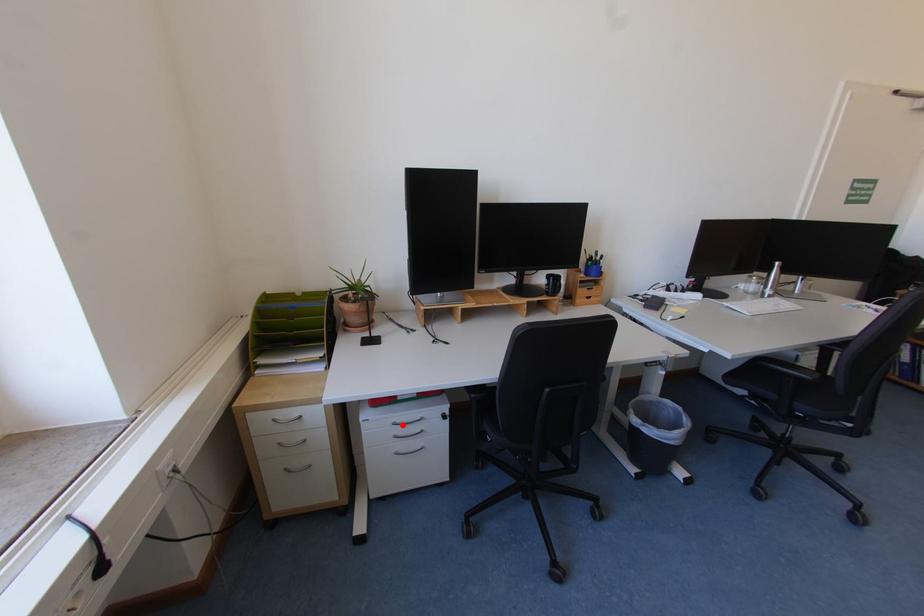
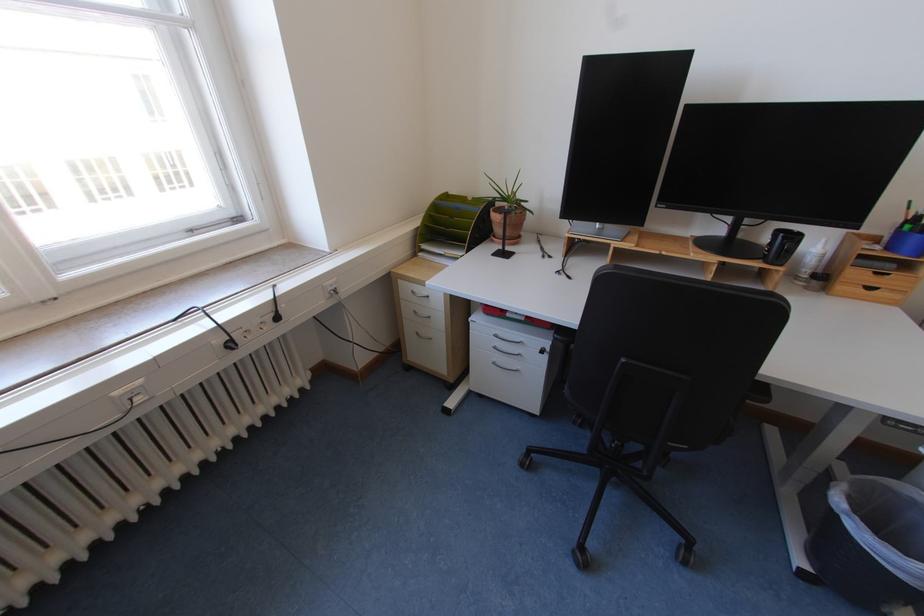
Question: I am providing you with two images of the same scene from different viewpoints. A red point is marked on the first image. At the location where the point appears in image 1, is it still visible in image 2?

Choices:
 (A) Yes
 (B) No

Answer: (A)